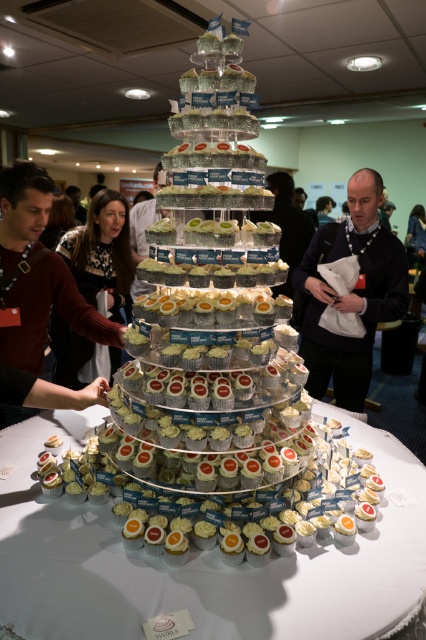
You are at a social event and see the dark brown sweater at center. Can you determine its exact location in the image using the coordinate system provided?

The dark brown sweater at center is located at point (x=101, y=252) according to the coordinate system provided.

You are at a social event and need to choose between two items displayed on a table. You see a dark brown sweater at center and a matte black jacket at center. Which item is taller?

The dark brown sweater at center is taller than the matte black jacket at center.

In the scene shown: You are at a social event and see two points marked on the cupcakes display. The first point is at coordinates point (377, 625) and the second is at point (152, 208). Which point is closer to you?

Point (377, 625) is in front of point (152, 208), so the first point is closer to you.